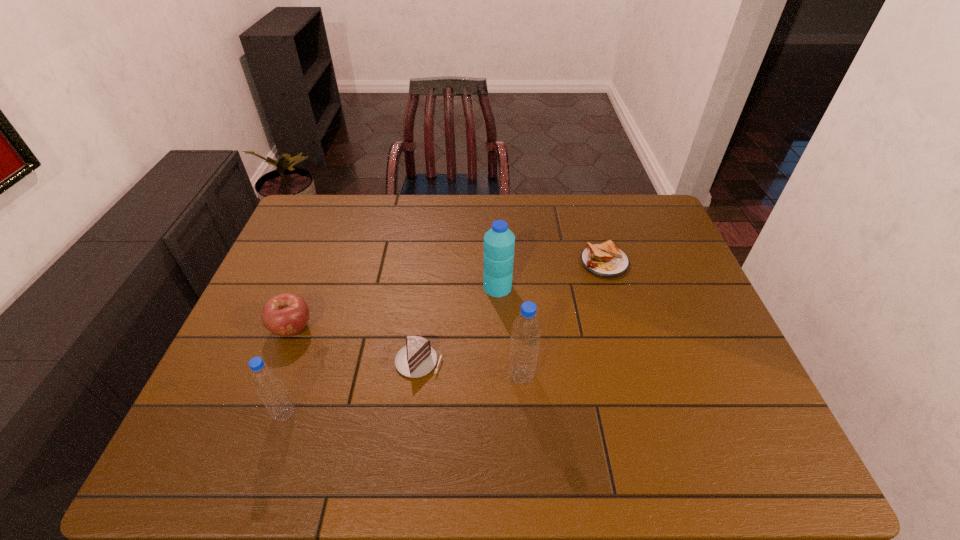
I want to click on free space at the right edge of the desktop, so click(709, 330).

This screenshot has height=540, width=960. What are the coordinates of `vacant point located between the chocolate cake and the nearest water bottle` in the screenshot? It's located at (352, 387).

At what (x,y) coordinates should I click in order to perform the action: click on vacant area that lies between the third object from left to right and the nearest object. Please return your answer as a coordinate pair (x, y). This screenshot has height=540, width=960. Looking at the image, I should click on point(352,387).

The image size is (960, 540). What are the coordinates of `free spot between the nearest object and the farthest water bottle` in the screenshot? It's located at (392, 350).

Where is `vacant area that lies between the chocolate cake and the nearest water bottle`? This screenshot has width=960, height=540. vacant area that lies between the chocolate cake and the nearest water bottle is located at coordinates click(352, 387).

Locate an element on the screen. vacant region between the rightmost object and the fourth object from right to left is located at coordinates (512, 312).

Find the location of a particular element. free space between the sandwich and the second farthest water bottle is located at coordinates (563, 319).

Where is `vacant area that lies between the second nearest water bottle and the chocolate cake`? This screenshot has width=960, height=540. vacant area that lies between the second nearest water bottle and the chocolate cake is located at coordinates (470, 368).

Find the location of a particular element. blank region between the fourth tallest object and the fifth tallest object is located at coordinates (355, 345).

You are a GUI agent. You are given a task and a screenshot of the screen. Output one action in this format:
    pyautogui.click(x=<x>, y=<y>)
    Task: Click on the fourth closest object to the second shortest object
    Image resolution: width=960 pixels, height=540 pixels.
    Given the screenshot: What is the action you would take?
    pyautogui.click(x=287, y=314)